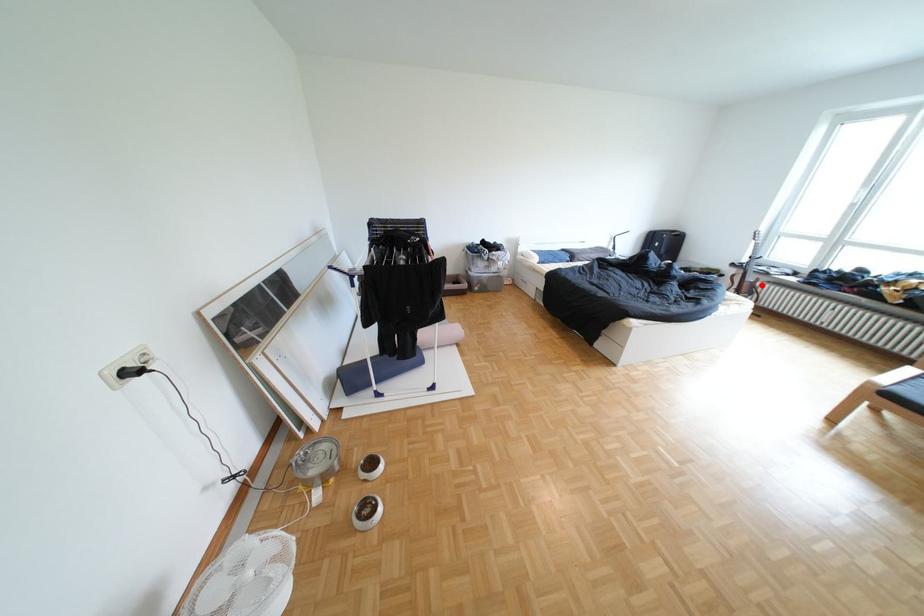
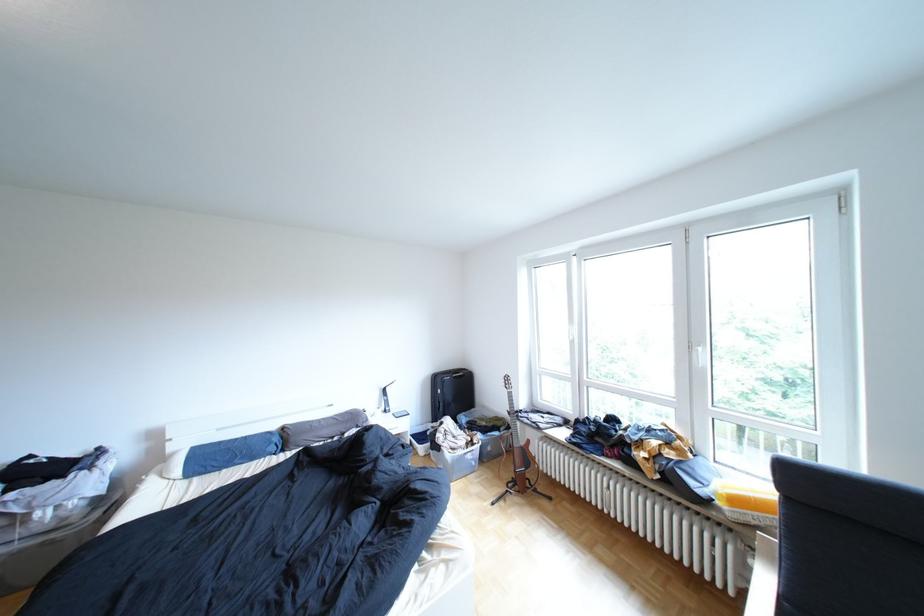
The point at the highlighted location is marked in the first image. Where is the corresponding point in the second image?

(532, 453)